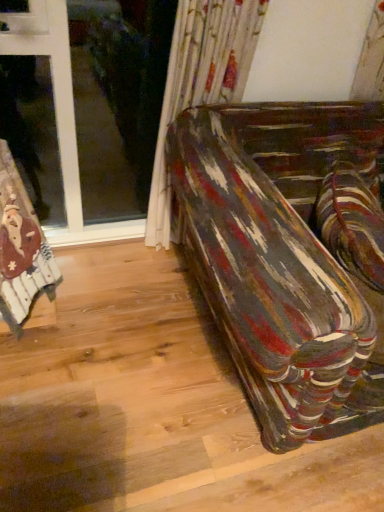
This screenshot has height=512, width=384. What are the coordinates of `vacant space to the right of white fabric tablecloth at left` in the screenshot? It's located at (87, 321).